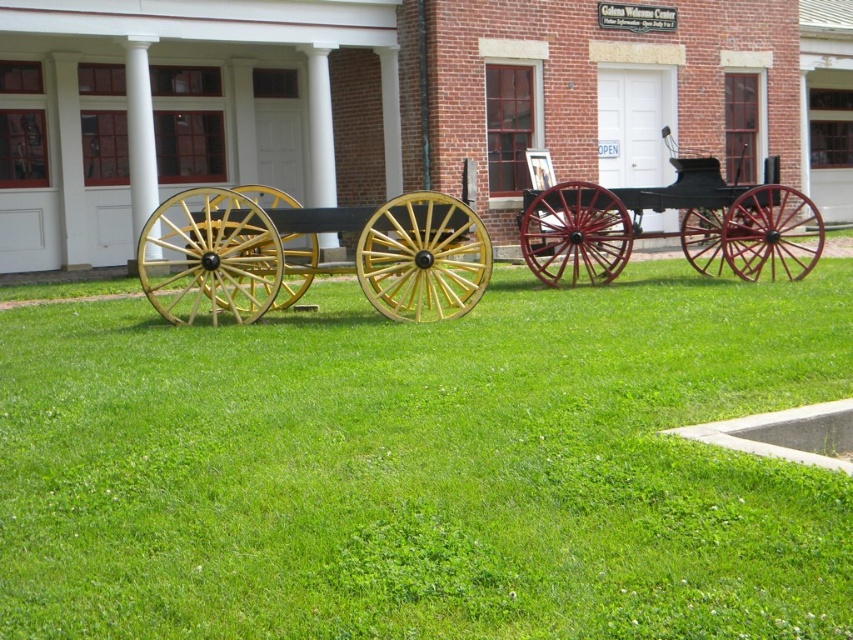
You are standing at the origin point of the coordinate system. The Welcome Center is located at the building with white columns and red windows. If you want to reach the wooden wagon wheels at center, in which direction should you move relative to your current position?

The wooden wagon wheels at center are located at coordinate point 0.411 in the x direction and 0.362 in the y direction. Since you are at the origin, you should move in the positive x and positive y directions to reach them.

You are standing in front of the brick building with the wagon wheels. You want to place a 2.5 meter long banner on the ground between you and the green grass at center. Will the banner fit entirely within this space?

The green grass at center is 3.06 meters from the viewer. Since the banner is 2.5 meters long, it will fit entirely within the space between you and the green grass at center.

You are standing at the entrance of the Welcome Center and see the green grass at center and the polished wood cart at center. Which object is closer to you?

The green grass at center is closer to you because it is in front of the polished wood cart at center.